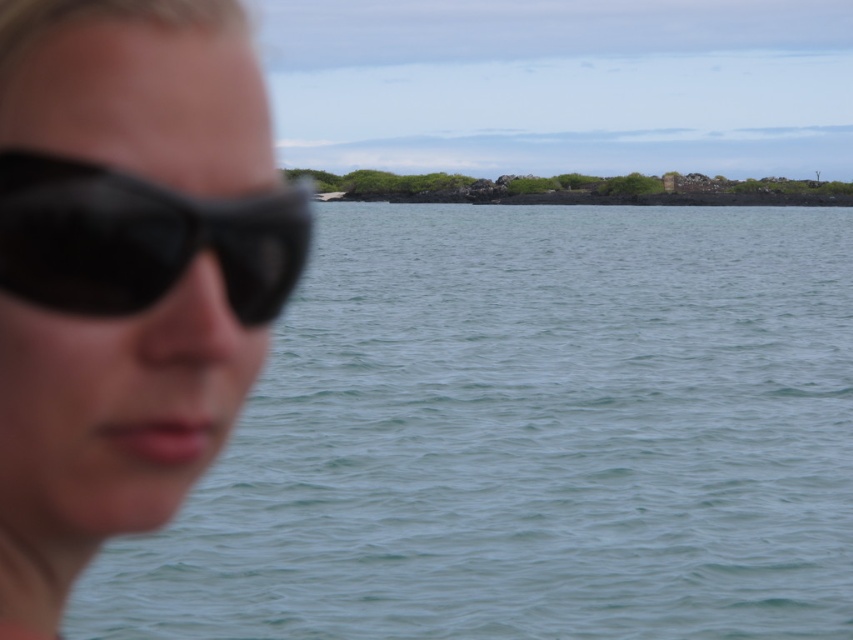
Is matte black sunglasses at left to the right of black matte sunglasses at left from the viewer's perspective?

Incorrect, matte black sunglasses at left is not on the right side of black matte sunglasses at left.

Can you confirm if matte black sunglasses at left is positioned to the left of black matte sunglasses at left?

Indeed, matte black sunglasses at left is positioned on the left side of black matte sunglasses at left.

Does point (85, 532) lie in front of point (27, 166)?

No, it is not.

The width and height of the screenshot is (853, 640). I want to click on matte black sunglasses at left, so click(126, 272).

Does clear water at center appear over matte black sunglasses at left?

Indeed, clear water at center is positioned over matte black sunglasses at left.

Is clear water at center to the right of matte black sunglasses at left from the viewer's perspective?

Yes, clear water at center is to the right of matte black sunglasses at left.

Is point (692, 326) farther from camera compared to point (91, 320)?

Yes, it is behind point (91, 320).

You are a GUI agent. You are given a task and a screenshot of the screen. Output one action in this format:
    pyautogui.click(x=<x>, y=<y>)
    Task: Click on the clear water at center
    The height and width of the screenshot is (640, 853).
    Given the screenshot: What is the action you would take?
    pyautogui.click(x=527, y=436)

Find the location of a particular element. This screenshot has width=853, height=640. clear water at center is located at coordinates (527, 436).

Measure the distance between point (596, 492) and camera.

A distance of 23.41 meters exists between point (596, 492) and camera.

Find the location of a particular element. The image size is (853, 640). clear water at center is located at coordinates (527, 436).